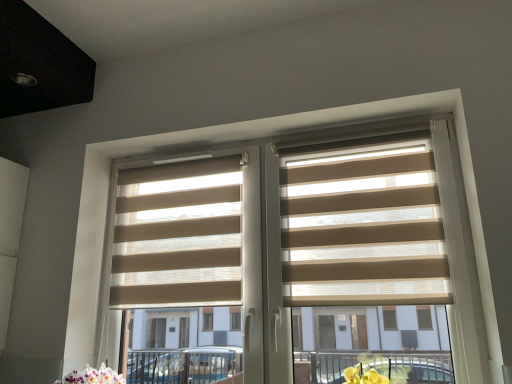
Question: From the image's perspective, is beige fabric blinds at center located above or below beige fabric blinds at center, arranged as the 2th blind when viewed from the right?

Choices:
 (A) below
 (B) above

Answer: (A)

Question: From a real-world perspective, relative to beige fabric blinds at center, arranged as the 1th blind when viewed from the left, is beige fabric blinds at center vertically above or below?

Choices:
 (A) below
 (B) above

Answer: (A)

Question: Which object is positioned farthest from the beige fabric blinds at center, arranged as the 1th blind when viewed from the left?

Choices:
 (A) beige fabric blinds at center, the second blind from the left
 (B) beige fabric blinds at center

Answer: (A)

Question: Which is nearer to the beige fabric blinds at center, arranged as the 2th blind when viewed from the right?

Choices:
 (A) beige fabric blinds at center, the second blind from the left
 (B) beige fabric blinds at center

Answer: (B)